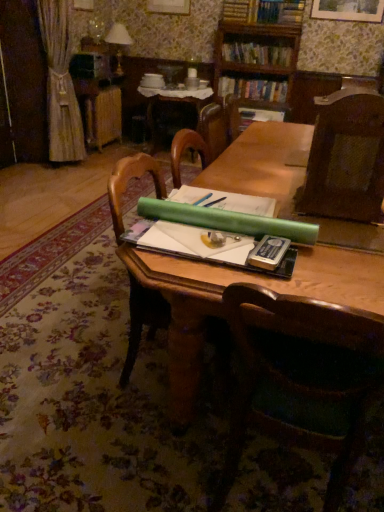
Question: Considering the relative sizes of wooden table at center, marked as the 1th table in a bottom-to-top arrangement, and hardcover book at upper center, marked as the second book in a bottom-to-top arrangement, in the image provided, is wooden table at center, marked as the 1th table in a bottom-to-top arrangement, wider than hardcover book at upper center, marked as the second book in a bottom-to-top arrangement,?

Choices:
 (A) no
 (B) yes

Answer: (B)

Question: Is wooden table at center, marked as the 1th table in a bottom-to-top arrangement, turned away from hardcover book at upper center, acting as the 1th book starting from the top?

Choices:
 (A) no
 (B) yes

Answer: (B)

Question: From the image's perspective, does wooden table at center, the 2th table from the back, appear higher than hardcover book at upper center, marked as the second book in a bottom-to-top arrangement?

Choices:
 (A) no
 (B) yes

Answer: (A)

Question: Can you confirm if wooden table at center, which ranks as the 1th table in front-to-back order, is smaller than hardcover book at upper center, acting as the 1th book starting from the top?

Choices:
 (A) no
 (B) yes

Answer: (A)

Question: Can you confirm if wooden table at center, which ranks as the 1th table in front-to-back order, is thinner than hardcover book at upper center, acting as the 1th book starting from the top?

Choices:
 (A) no
 (B) yes

Answer: (A)

Question: From the image's perspective, is wooden table at center, marked as the 1th table in a bottom-to-top arrangement, located beneath hardcover book at upper center, marked as the second book in a bottom-to-top arrangement?

Choices:
 (A) yes
 (B) no

Answer: (A)

Question: Considering the relative sizes of hardcover book at upper center, acting as the 1th book starting from the top, and wooden table at center, the 2th table from the back, in the image provided, is hardcover book at upper center, acting as the 1th book starting from the top, shorter than wooden table at center, the 2th table from the back,?

Choices:
 (A) yes
 (B) no

Answer: (A)

Question: Is hardcover book at upper center, acting as the 1th book starting from the top, in front of wooden table at center, the 2th table from the back?

Choices:
 (A) yes
 (B) no

Answer: (B)

Question: From a real-world perspective, is hardcover book at upper center, acting as the 1th book starting from the top, over wooden table at center, marked as the 1th table in a bottom-to-top arrangement?

Choices:
 (A) yes
 (B) no

Answer: (A)

Question: From the image's perspective, is hardcover book at upper center, marked as the second book in a bottom-to-top arrangement, on wooden table at center, the 2th table from the back?

Choices:
 (A) yes
 (B) no

Answer: (A)

Question: Is the depth of hardcover book at upper center, marked as the second book in a bottom-to-top arrangement, greater than that of wooden table at center, marked as the 1th table in a bottom-to-top arrangement?

Choices:
 (A) yes
 (B) no

Answer: (A)

Question: From a real-world perspective, is hardcover book at upper center, marked as the second book in a bottom-to-top arrangement, positioned under wooden table at center, which ranks as the 1th table in front-to-back order, based on gravity?

Choices:
 (A) no
 (B) yes

Answer: (A)

Question: Considering the relative sizes of brown textured chair at right, the first chair from the top, and metallic silver paperback book at center in the image provided, is brown textured chair at right, the first chair from the top, smaller than metallic silver paperback book at center?

Choices:
 (A) no
 (B) yes

Answer: (A)